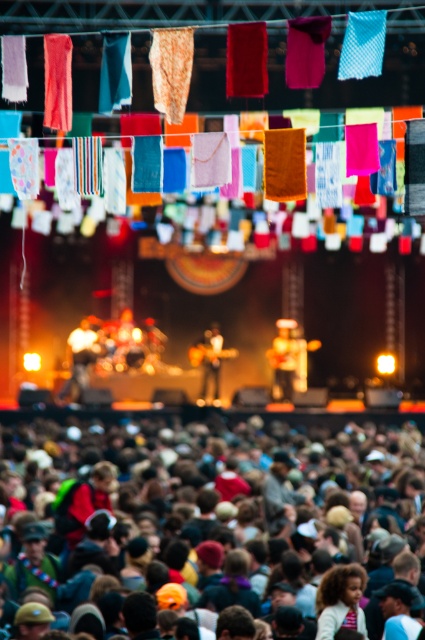
How far apart are matte black guitar at center and wooden guitar at center?

5.58 meters

Which of these two, matte black guitar at center or wooden guitar at center, stands taller?

wooden guitar at center

Which is behind, point (70, 396) or point (215, 353)?

The point (215, 353) is more distant.

You are a GUI agent. You are given a task and a screenshot of the screen. Output one action in this format:
    pyautogui.click(x=<x>, y=<y>)
    Task: Click on the matte black guitar at center
    The height and width of the screenshot is (640, 425).
    Given the screenshot: What is the action you would take?
    pyautogui.click(x=81, y=356)

Is multicolored fabric at lower center bigger than matte black guitar at center?

Correct, multicolored fabric at lower center is larger in size than matte black guitar at center.

Between point (314, 564) and point (82, 355), which one is positioned in front?

Point (314, 564)

Does point (178, 432) lie behind point (82, 380)?

No, (178, 432) is closer to viewer.

The width and height of the screenshot is (425, 640). I want to click on multicolored fabric at lower center, so click(220, 508).

How far apart are multicolored fabric at lower center and matte brown guitar at center?

multicolored fabric at lower center and matte brown guitar at center are 42.30 feet apart from each other.

Which is above, multicolored fabric at lower center or matte brown guitar at center?

matte brown guitar at center is higher up.

Image resolution: width=425 pixels, height=640 pixels. What do you see at coordinates (220, 508) in the screenshot?
I see `multicolored fabric at lower center` at bounding box center [220, 508].

Identify the location of multicolored fabric at lower center. (220, 508).